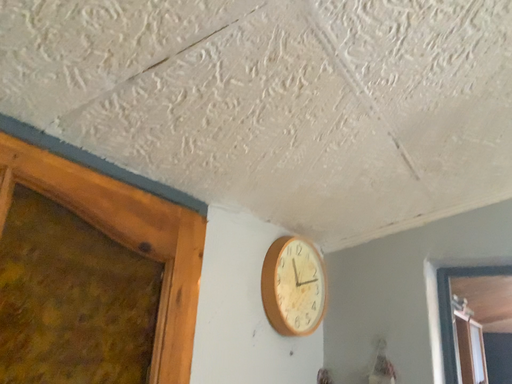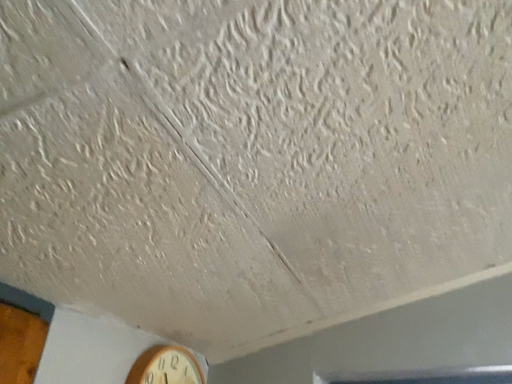
Question: How did the camera likely rotate when shooting the video?

Choices:
 (A) rotated upward
 (B) rotated downward

Answer: (A)